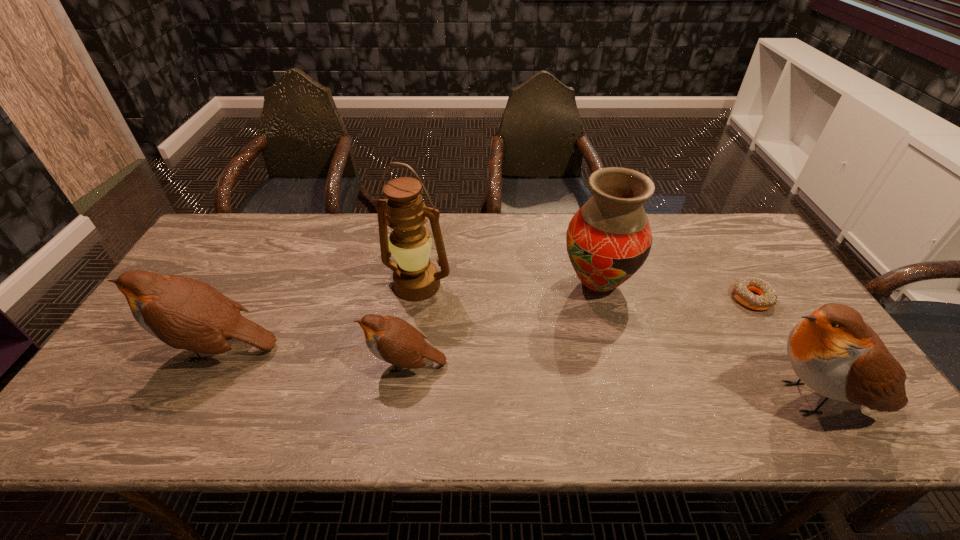
Identify the location of vacant region located 0.290m at the face of the second shortest object. (247, 364).

Locate an element on the screen. vacant space located 0.140m at the face of the second shortest object is located at coordinates (308, 364).

Locate an element on the screen. Image resolution: width=960 pixels, height=540 pixels. vacant space located 0.260m at the face of the second shortest object is located at coordinates [259, 364].

Locate an element on the screen. vacant position located 0.370m at the face of the rightmost bird is located at coordinates (583, 398).

Locate an element on the screen. The width and height of the screenshot is (960, 540). vacant space located at the face of the rightmost bird is located at coordinates (591, 398).

The height and width of the screenshot is (540, 960). What are the coordinates of `free space located 0.350m at the face of the rightmost bird` in the screenshot? It's located at (591, 398).

Locate an element on the screen. The width and height of the screenshot is (960, 540). vacant region located on the front of the vase is located at coordinates (609, 326).

The height and width of the screenshot is (540, 960). I want to click on free space located on the front of the shortest object, so click(810, 393).

Where is `vacant region located on the left of the oil lamp`? vacant region located on the left of the oil lamp is located at coordinates (319, 285).

Locate an element on the screen. object situated at the left edge is located at coordinates (184, 313).